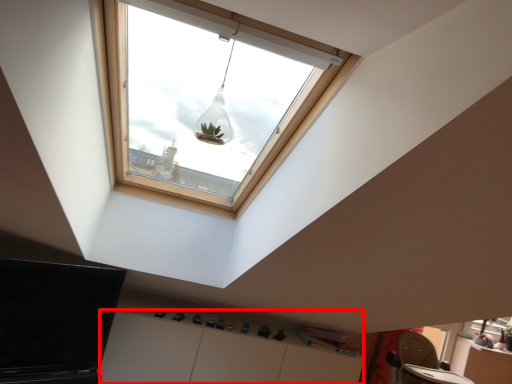
Question: Considering the relative positions of cabinetry (annotated by the red box) and light fixture in the image provided, where is cabinetry (annotated by the red box) located with respect to the staircase?

Choices:
 (A) left
 (B) right

Answer: (A)